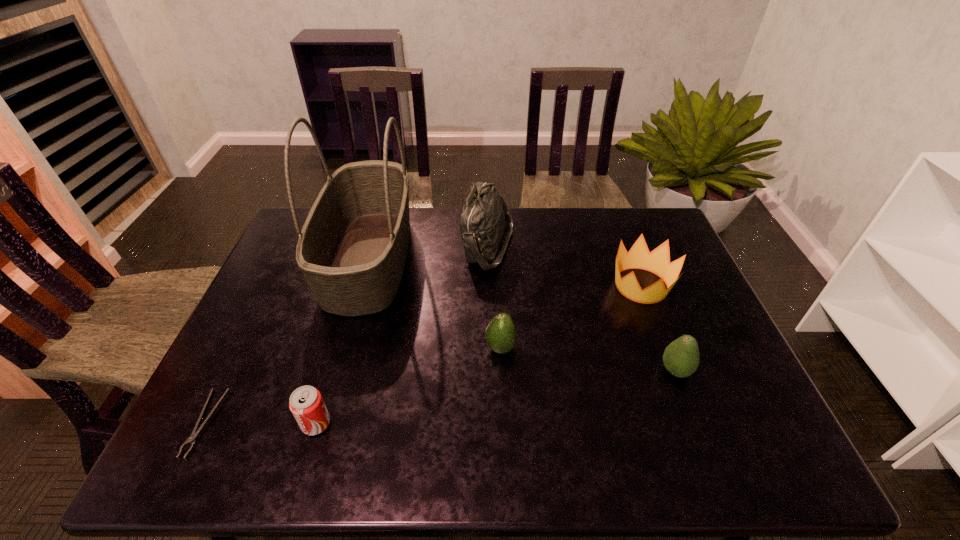
You are a GUI agent. You are given a task and a screenshot of the screen. Output one action in this format:
    pyautogui.click(x=<x>, y=<y>)
    Task: Click on the tongs that is at the near edge
    This screenshot has height=540, width=960.
    Given the screenshot: What is the action you would take?
    [x=192, y=439]

Find the location of a particular element. The width and height of the screenshot is (960, 540). basket that is at the left edge is located at coordinates (352, 250).

Locate an element on the screen. tongs present at the left edge is located at coordinates (192, 439).

The width and height of the screenshot is (960, 540). What are the coordinates of `crown that is at the right edge` in the screenshot? It's located at (657, 261).

This screenshot has height=540, width=960. I want to click on avocado that is at the right edge, so pyautogui.click(x=681, y=357).

The width and height of the screenshot is (960, 540). I want to click on object at the far left corner, so click(x=352, y=250).

This screenshot has width=960, height=540. Find the location of `object at the near left corner`. object at the near left corner is located at coordinates (192, 439).

What are the coordinates of `free space at the far edge` in the screenshot? It's located at (510, 248).

In the image, there is a desktop. Find the location of `vacant space at the near edge`. vacant space at the near edge is located at coordinates (681, 462).

I want to click on vacant region at the left edge of the desktop, so click(x=287, y=260).